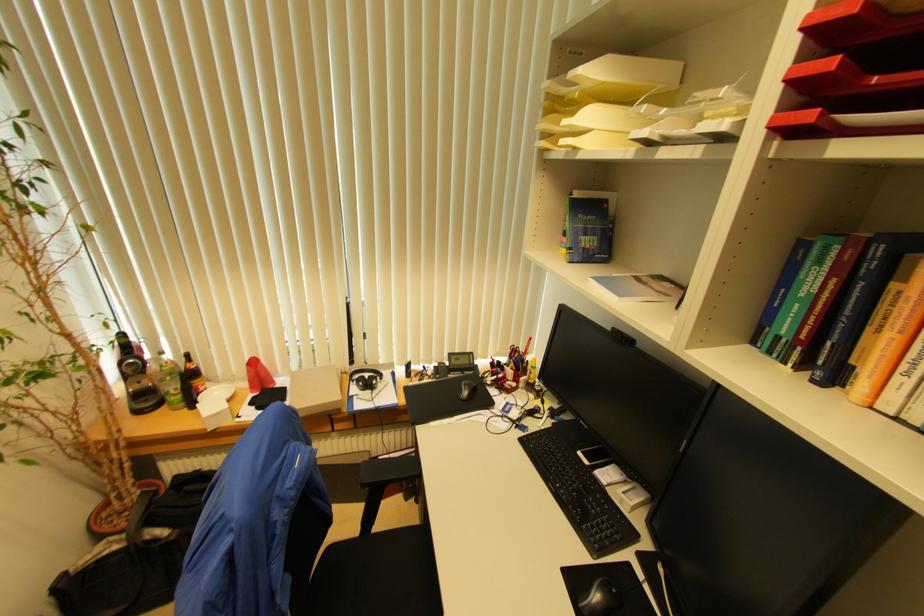
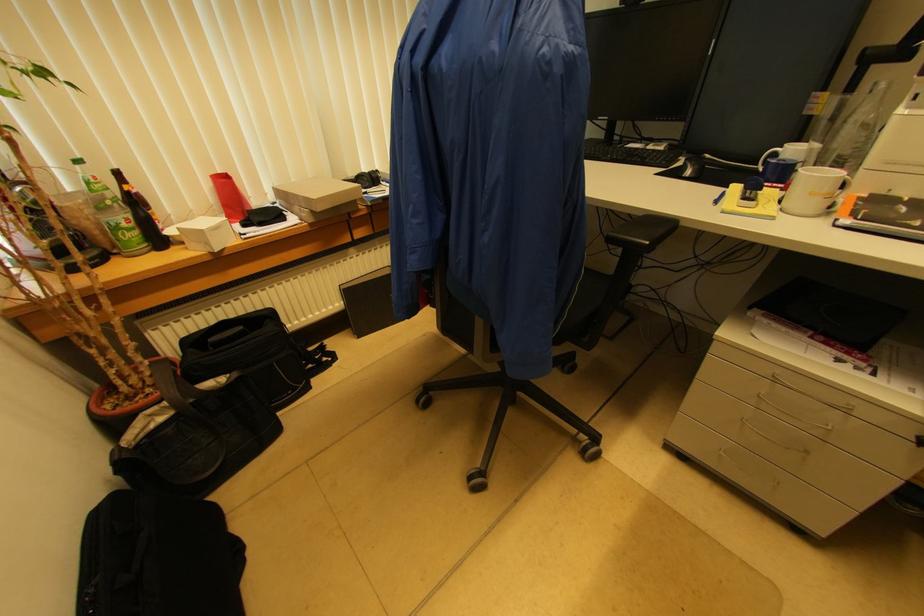
Question: I am providing you with two images of the same scene from different viewpoints. Please identify which objects are invisible in image2.

Choices:
 (A) blue stapler
 (B) blue pen
 (C) cardboard box
 (D) none of these

Answer: (D)